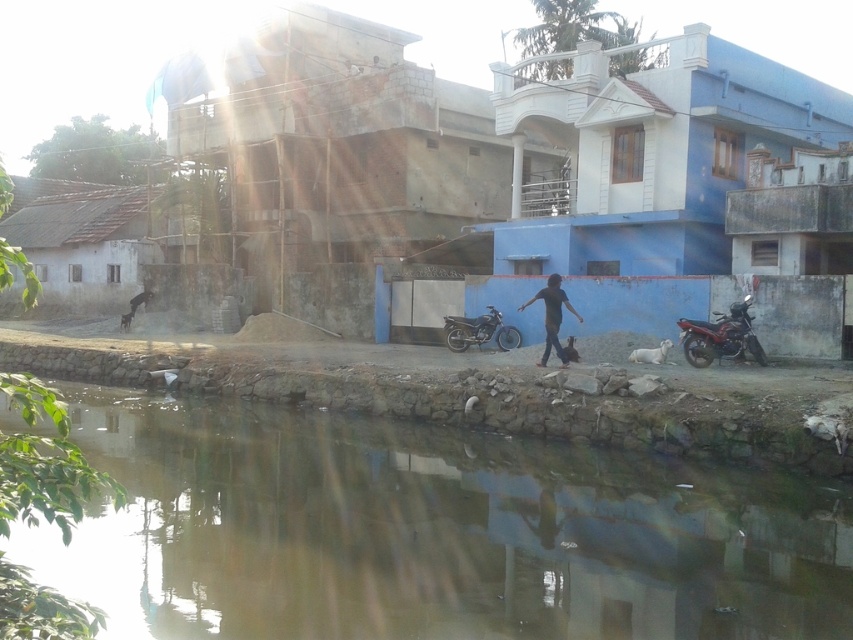
You are a photographer trying to capture both motorcycles in a single frame. Given that your camera can only focus on objects wider than 1.2 meters, which motorcycle between the shiny metallic motorcycle at right and the shiny metallic motorcycle at center should you prioritize to ensure it is in focus?

The shiny metallic motorcycle at center should be prioritized because its width is greater than the shiny metallic motorcycle at right, making it more likely to be wider than 1.2 meters and thus in focus.

You are standing at the center of the image and want to locate the shiny metallic motorcycle at right. According to the coordinates, in which direction should you look to find it?

The shiny metallic motorcycle at right is located at coordinates point (720, 337), so you should look to the right side of the image to find it.